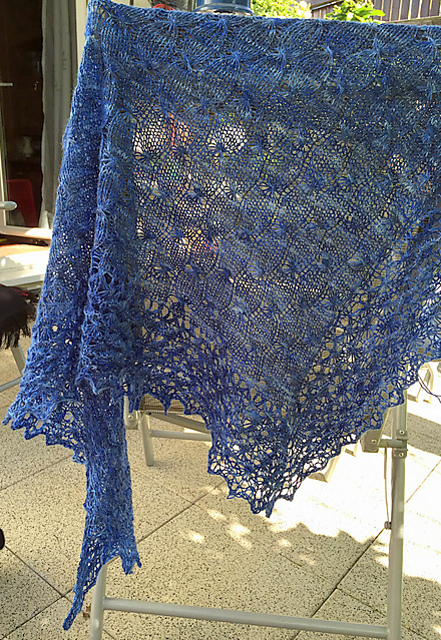
Where is `tile`? The width and height of the screenshot is (441, 640). tile is located at coordinates (273, 570).